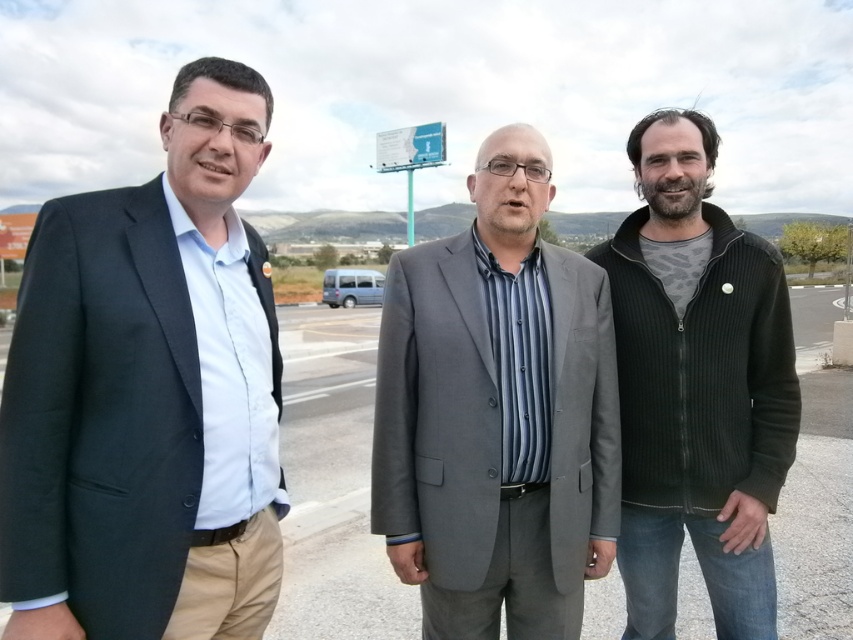
Question: Which object is positioned closest to the matte black suit at left?

Choices:
 (A) white plastic billboard at center
 (B) ribbed fleece jacket at right
 (C) gray suit at center

Answer: (C)

Question: Does ribbed fleece jacket at right appear under white plastic billboard at center?

Choices:
 (A) no
 (B) yes

Answer: (B)

Question: Considering the relative positions of ribbed fleece jacket at right and white plastic billboard at center in the image provided, where is ribbed fleece jacket at right located with respect to white plastic billboard at center?

Choices:
 (A) above
 (B) below

Answer: (B)

Question: Does matte black suit at left appear under white plastic billboard at center?

Choices:
 (A) yes
 (B) no

Answer: (A)

Question: Which point is farther from the camera taking this photo?

Choices:
 (A) (729, 573)
 (B) (538, 172)
 (C) (421, 144)

Answer: (C)

Question: Which point is closer to the camera?

Choices:
 (A) (154, 547)
 (B) (645, 371)

Answer: (A)